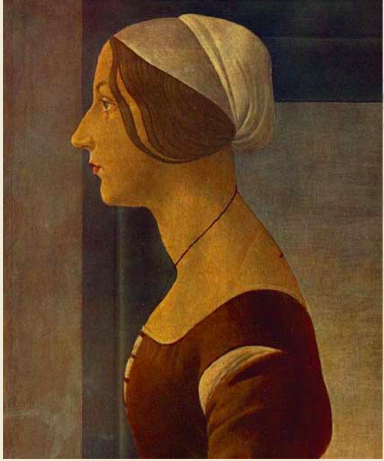
Find the location of `grey wall`. grey wall is located at coordinates (360, 381), (347, 356).